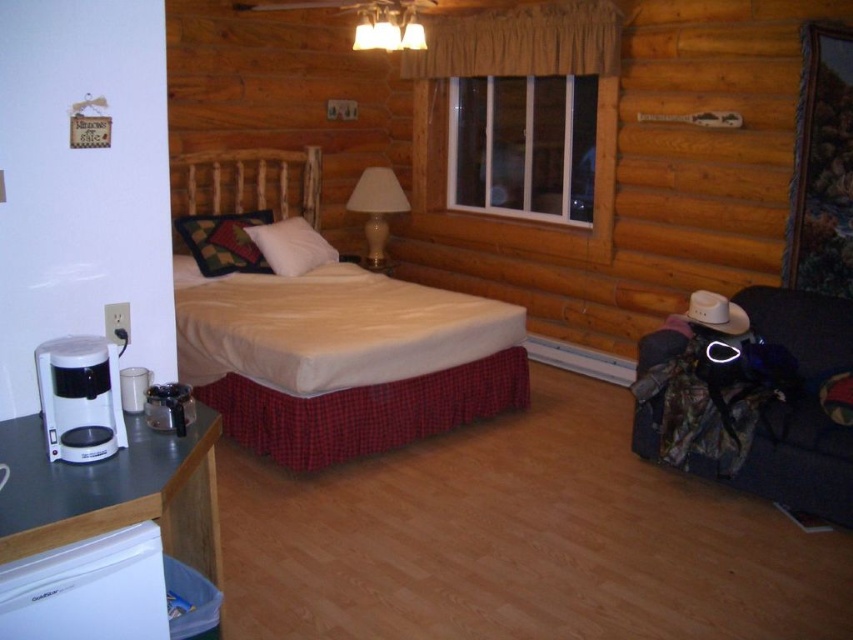
Question: Which object appears farthest from the camera in this image?

Choices:
 (A) matte glass lamp at upper center
 (B) multicolored woven pillow at center
 (C) white soft pillow at center

Answer: (C)

Question: Does camouflage fabric bag at lower right have a greater width compared to white soft pillow at center?

Choices:
 (A) yes
 (B) no

Answer: (A)

Question: Which point is closer to the camera taking this photo?

Choices:
 (A) (273, 259)
 (B) (354, 208)
 (C) (368, 26)
 (D) (750, 300)

Answer: (D)

Question: Which object appears closest to the camera in this image?

Choices:
 (A) white plastic coffee maker at lower left
 (B) camouflage fabric bag at lower right
 (C) multicolored woven pillow at center
 (D) white ceramic lamp at upper center

Answer: (A)

Question: Is white soft pillow at center positioned in front of matte glass lamp at upper center?

Choices:
 (A) no
 (B) yes

Answer: (A)

Question: Can you confirm if multicolored woven pillow at center is positioned below white soft pillow at center?

Choices:
 (A) yes
 (B) no

Answer: (B)